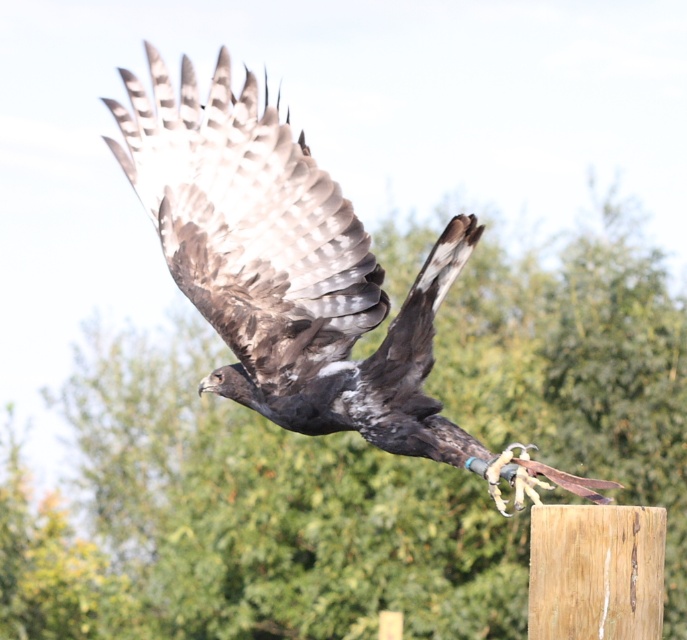
Question: Which point is closer to the camera?

Choices:
 (A) (429, 445)
 (B) (646, 506)

Answer: (B)

Question: Is gray feathered wing at center to the left of wooden post at center from the viewer's perspective?

Choices:
 (A) yes
 (B) no

Answer: (A)

Question: Which is farther from the wooden post at center?

Choices:
 (A) gray feathered wing at center
 (B) dark brown feathers at center
 (C) green leafy tree at upper center

Answer: (C)

Question: Is green leafy tree at upper center to the right of dark brown feathers at center from the viewer's perspective?

Choices:
 (A) no
 (B) yes

Answer: (A)

Question: Which point is farther to the camera?

Choices:
 (A) (100, 634)
 (B) (529, 561)
 (C) (418, 316)

Answer: (A)

Question: Where is green leafy tree at upper center located in relation to dark brown feathers at center in the image?

Choices:
 (A) right
 (B) left

Answer: (B)